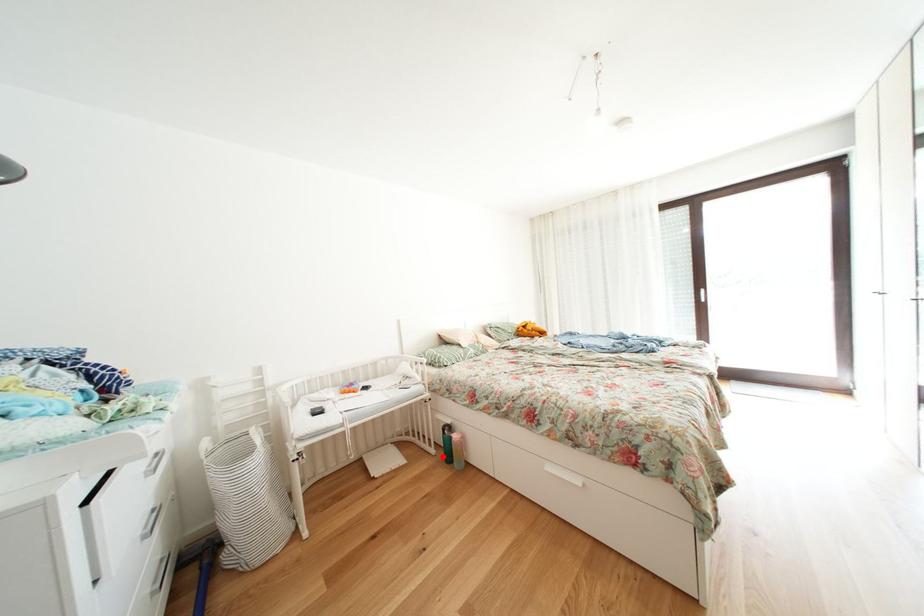
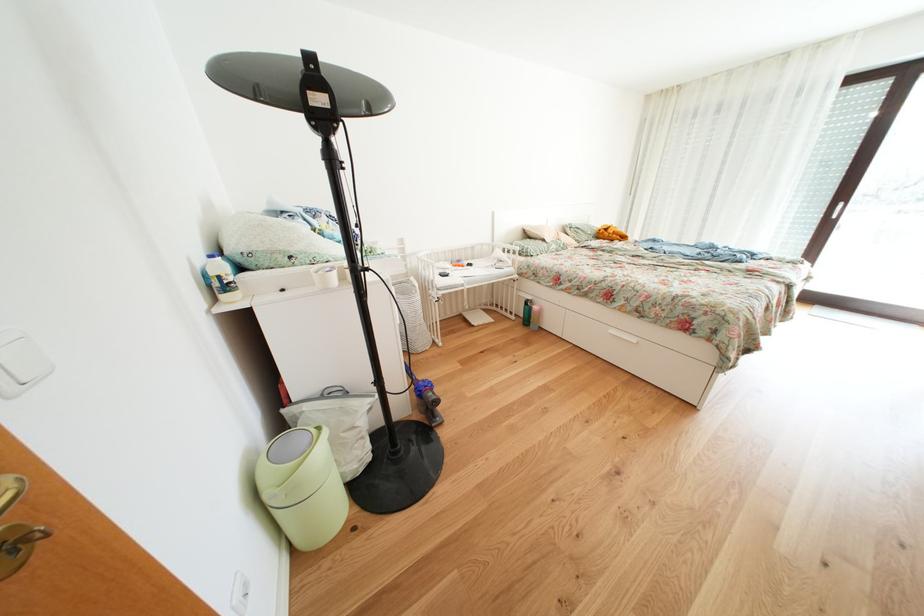
Question: I am providing you with two images of the same scene from different viewpoints. Given a red point in image1, look at the same physical point in image2. Is it:

Choices:
 (A) Closer to the viewpoint
 (B) Farther from the viewpoint

Answer: (A)